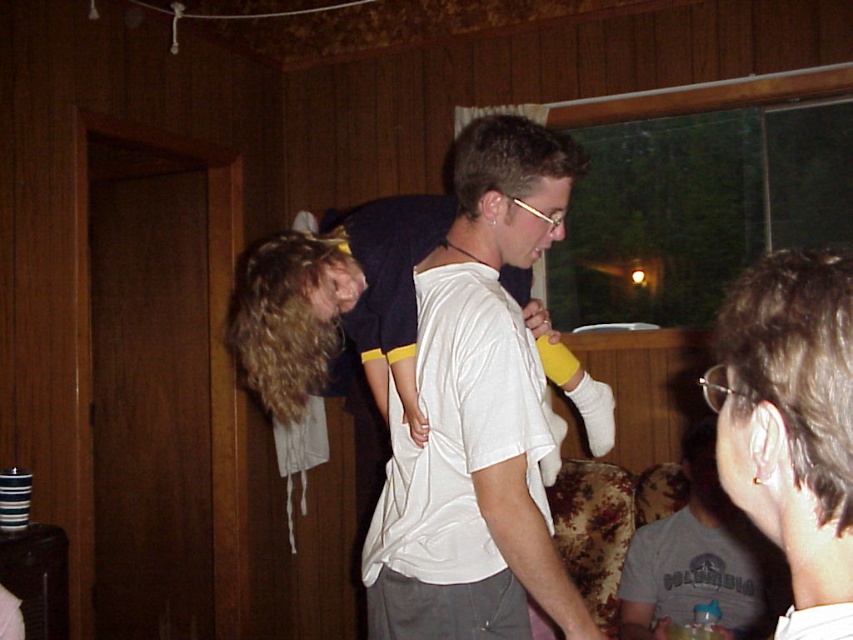
Question: Can you confirm if blonde hair at center is positioned to the left of gray cotton t-shirt at center?

Choices:
 (A) no
 (B) yes

Answer: (B)

Question: Among these points, which one is farthest from the camera?

Choices:
 (A) (685, 595)
 (B) (523, 150)

Answer: (A)

Question: Among these points, which one is farthest from the camera?

Choices:
 (A) (704, 561)
 (B) (447, 500)

Answer: (A)

Question: Is the position of blonde hair at center less distant than that of gray cotton t-shirt at center?

Choices:
 (A) no
 (B) yes

Answer: (B)

Question: Does blonde hair at center have a smaller size compared to gray cotton t-shirt at center?

Choices:
 (A) yes
 (B) no

Answer: (A)